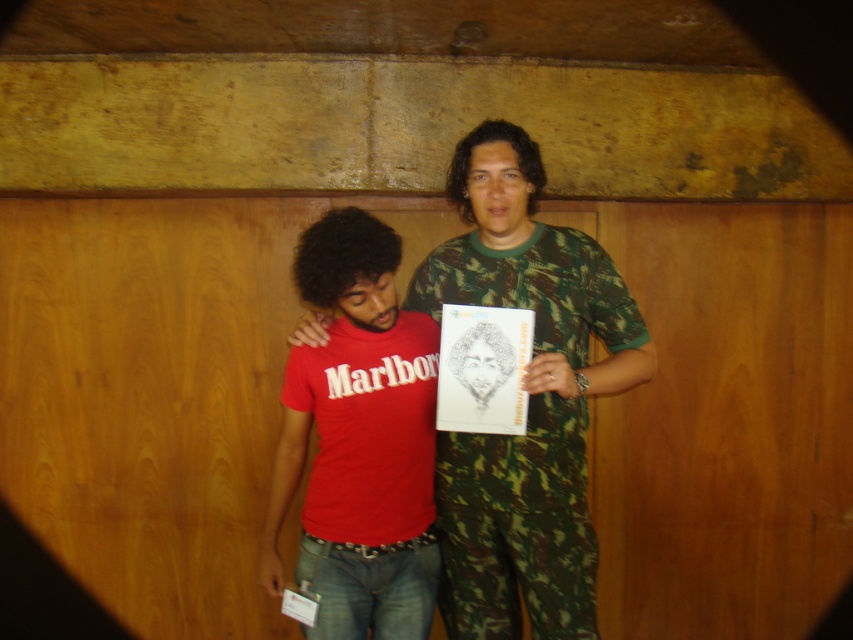
Can you confirm if camouflage fabric at center is smaller than matte black sketchbook at center?

No, camouflage fabric at center is not smaller than matte black sketchbook at center.

Is camouflage fabric at center behind matte black sketchbook at center?

No.

Where is `camouflage fabric at center`? The width and height of the screenshot is (853, 640). camouflage fabric at center is located at coordinates (527, 401).

Does red matte shirt at center lie in front of matte black sketchbook at center?

Yes, it is in front of matte black sketchbook at center.

Is red matte shirt at center above matte black sketchbook at center?

Actually, red matte shirt at center is below matte black sketchbook at center.

Image resolution: width=853 pixels, height=640 pixels. What are the coordinates of `red matte shirt at center` in the screenshot? It's located at (358, 440).

Where is `red matte shirt at center`? This screenshot has width=853, height=640. red matte shirt at center is located at coordinates (358, 440).

Which of these two, camouflage fabric at center or red matte shirt at center, stands taller?

With more height is camouflage fabric at center.

Is camouflage fabric at center shorter than red matte shirt at center?

Incorrect, camouflage fabric at center's height does not fall short of red matte shirt at center's.

This screenshot has height=640, width=853. I want to click on camouflage fabric at center, so click(x=527, y=401).

Where is `camouflage fabric at center`? This screenshot has height=640, width=853. camouflage fabric at center is located at coordinates (527, 401).